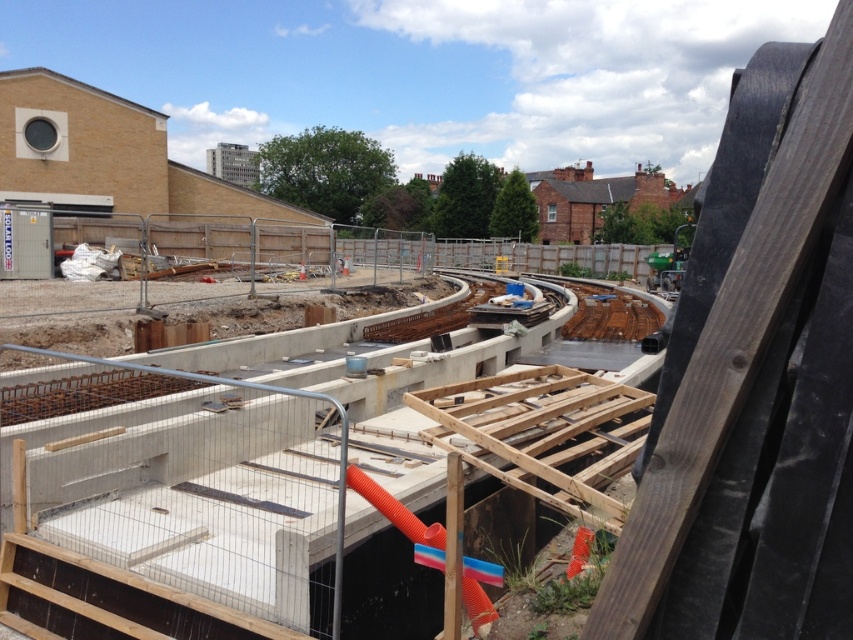
Is point (238, 392) less distant than point (611, 328)?

Yes, it is in front of point (611, 328).

Can you confirm if concrete at center is bigger than wooden at center?

Actually, concrete at center might be smaller than wooden at center.

Is point (305, 593) positioned after point (614, 317)?

No, (305, 593) is in front of (614, 317).

Where is `concrete at center`? concrete at center is located at coordinates (198, 508).